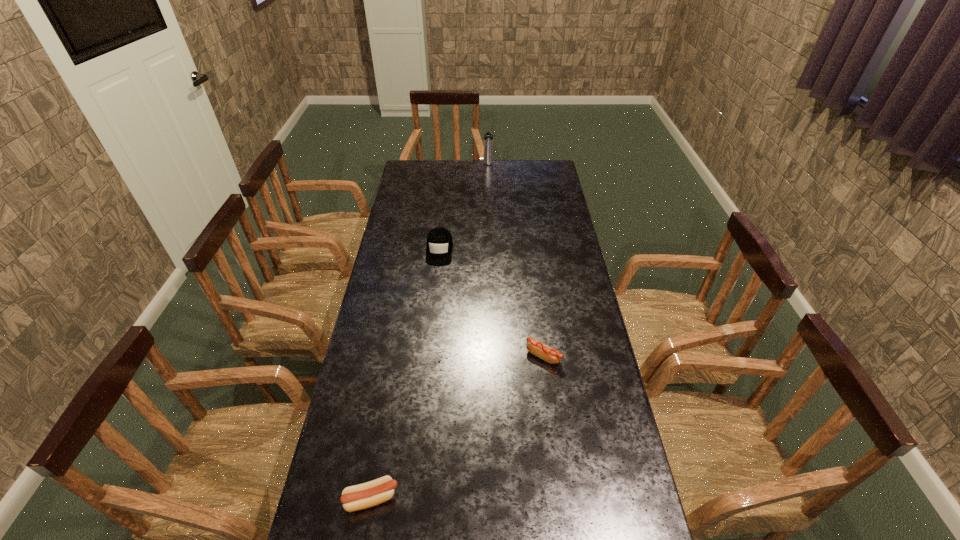
Where is `the third object from left to right`? the third object from left to right is located at coordinates point(488,137).

What are the coordinates of `thermos bottle` in the screenshot? It's located at pos(488,137).

Identify the location of the second farthest object. The image size is (960, 540). (439, 247).

At what (x,y) coordinates should I click in order to perform the action: click on cap. Please return your answer as a coordinate pair (x, y). Looking at the image, I should click on (439, 247).

The width and height of the screenshot is (960, 540). In order to click on the farther sausage in this screenshot , I will do `click(549, 354)`.

Locate an element on the screen. the second nearest object is located at coordinates (549, 354).

I want to click on the nearer sausage, so click(369, 494).

Locate an element on the screen. the left sausage is located at coordinates (369, 494).

Locate an element on the screen. Image resolution: width=960 pixels, height=540 pixels. vacant space located 0.160m on the handle side of the tallest object is located at coordinates (489, 184).

Where is `blank area located on the front-facing side of the cap`? The width and height of the screenshot is (960, 540). blank area located on the front-facing side of the cap is located at coordinates (431, 327).